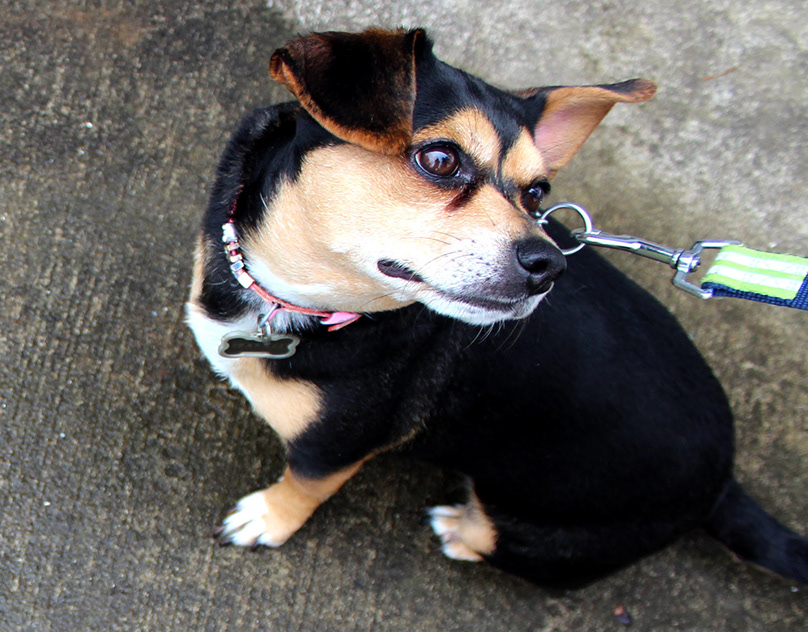
I want to click on rug, so click(187, 562).